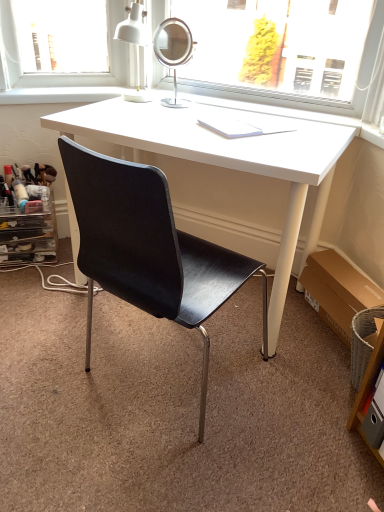
You are a GUI agent. You are given a task and a screenshot of the screen. Output one action in this format:
    pyautogui.click(x=<x>, y=<y>)
    Task: Click on the free space on the front side of black leather chair at center
    The height and width of the screenshot is (512, 384).
    Given the screenshot: What is the action you would take?
    pyautogui.click(x=134, y=470)